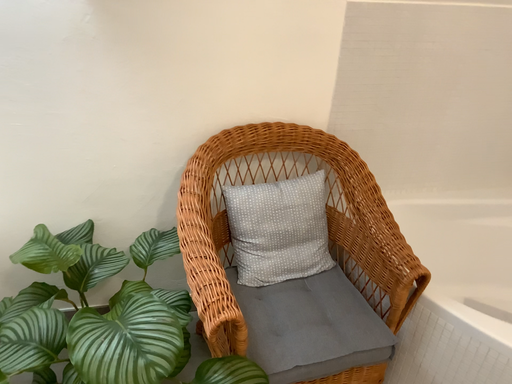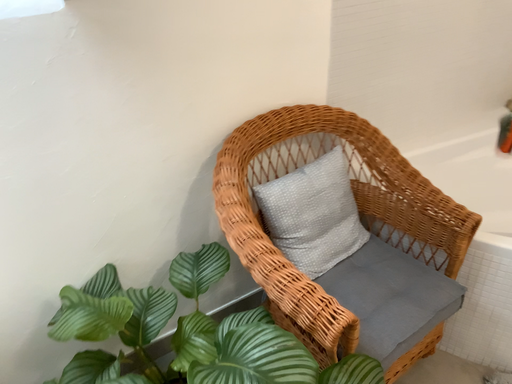
Question: Which way did the camera rotate in the video?

Choices:
 (A) rotated left
 (B) rotated right

Answer: (B)